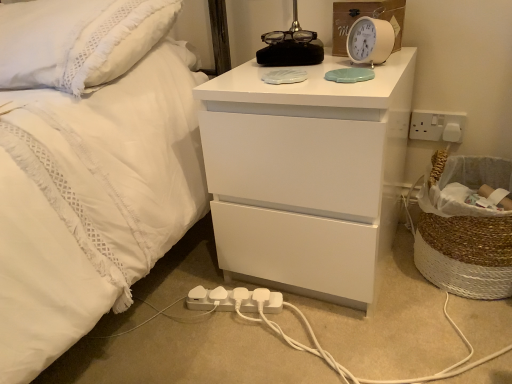
Question: Considering the positions of white plastic alarm clock at upper right and braided straw laundry basket at right in the image, is white plastic alarm clock at upper right bigger or smaller than braided straw laundry basket at right?

Choices:
 (A) big
 (B) small

Answer: (B)

Question: Do you think white plastic alarm clock at upper right is within braided straw laundry basket at right, or outside of it?

Choices:
 (A) inside
 (B) outside

Answer: (B)

Question: Which is nearer to the white plastic alarm clock at upper right?

Choices:
 (A) white plastic extension cord at lower center
 (B) braided straw laundry basket at right
 (C) white glossy chest of drawers at upper center
 (D) white plastic electric outlet at right
 (E) white textured pillow at upper left

Answer: (C)

Question: Considering the real-world distances, which object is farthest from the braided straw laundry basket at right?

Choices:
 (A) white textured pillow at upper left
 (B) white plastic alarm clock at upper right
 (C) white plastic extension cord at lower center
 (D) white plastic electric outlet at right
 (E) white glossy chest of drawers at upper center

Answer: (A)